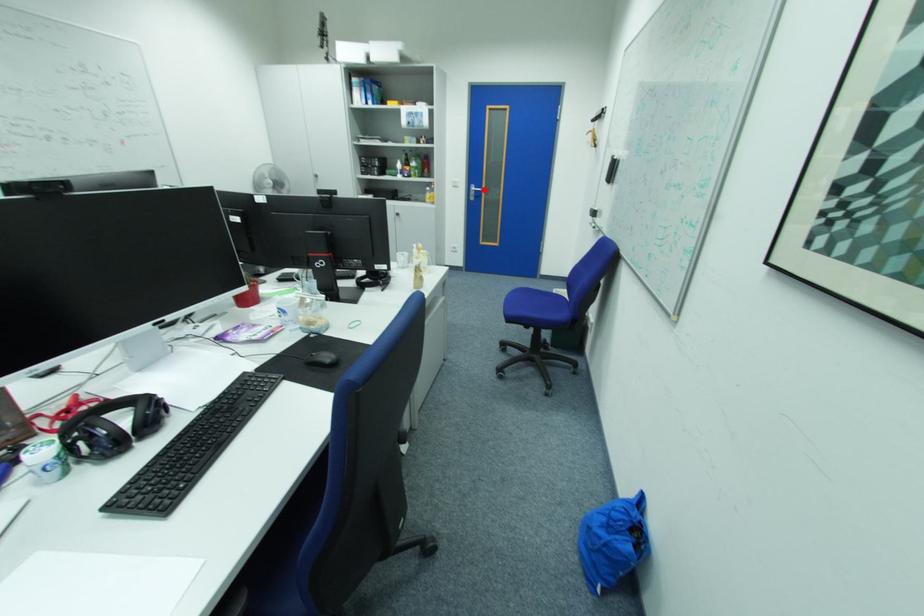
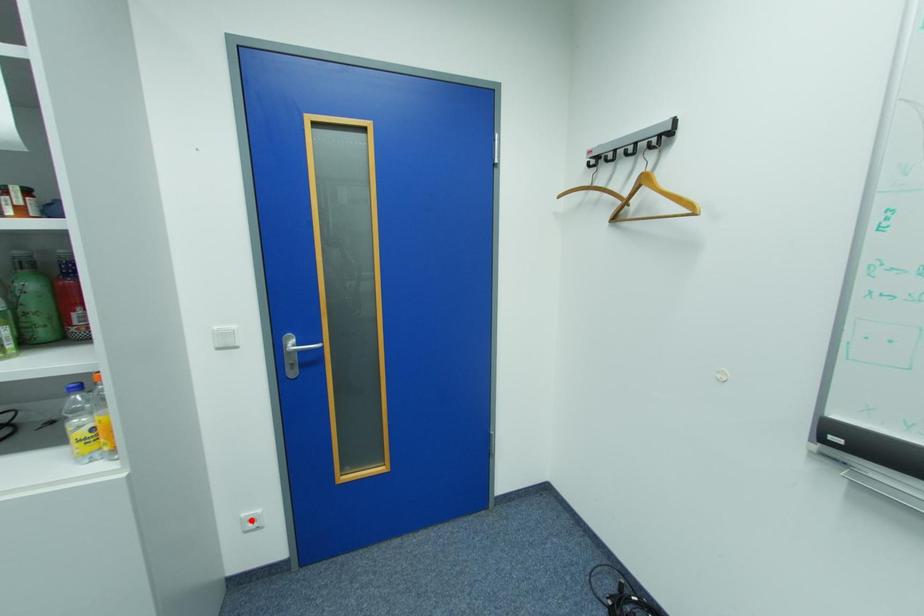
I am providing you with two images of the same scene from different viewpoints. A red point is marked on the first image and another point is marked on the second image. Are the points marked in image1 and image2 representing the same 3D position?

No